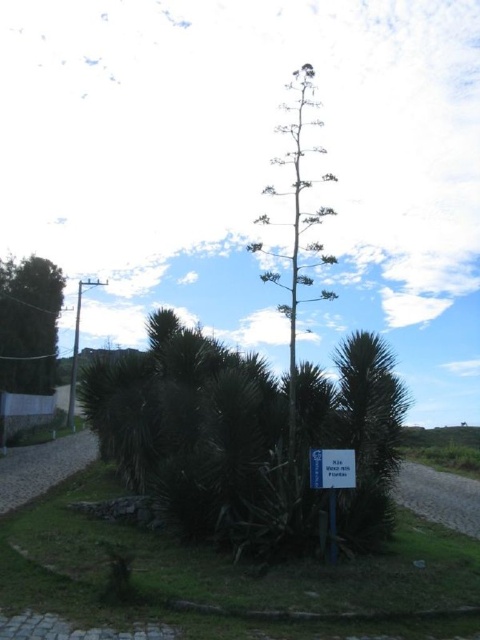
You are a gardener planning to place a blue plastic sign at center next to the green spiky palm tree at center. Given their widths, which object should you place first to ensure proper spacing?

The green spiky palm tree at center has a larger width than the blue plastic sign at center, so you should place the green spiky palm tree at center first to ensure proper spacing.

You are a hiker walking along the cobblestone path towards the green spiky palm tree at center and the white plastic sign at center. Which object will you encounter first?

The white plastic sign at center is to the left of the green spiky palm tree at center, so you will encounter the white plastic sign at center first as you walk along the path towards them.

You are standing at the origin point of the coordinate system. You want to walk to the dark green leafy tree at left. Which direction should you move in? Please provide your answer in terms of the coordinate system.

The dark green leafy tree at left is located at coordinate point (28,323), so you should move towards the positive x and positive y direction to reach it.